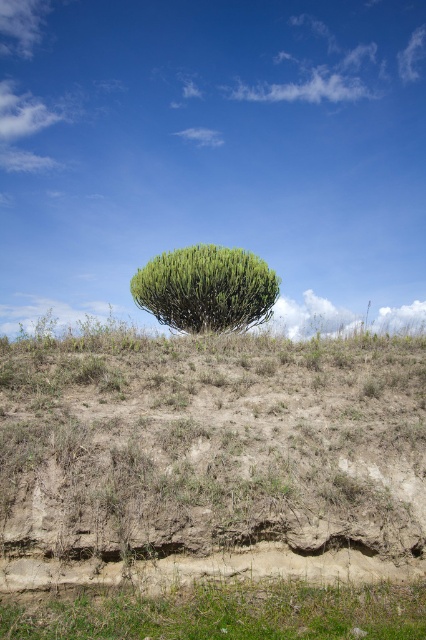
Image resolution: width=426 pixels, height=640 pixels. Describe the element at coordinates (210, 460) in the screenshot. I see `green grassy hillside at center` at that location.

Which is more to the left, green grassy hillside at center or green grassy at lower center?

Positioned to the left is green grassy hillside at center.

Which is behind, point (143, 353) or point (124, 589)?

Point (143, 353)

This screenshot has width=426, height=640. I want to click on green grassy hillside at center, so pos(210,460).

Does green grassy hillside at center have a greater height compared to green leafy tree at center?

No, green grassy hillside at center is not taller than green leafy tree at center.

Looking at this image, which is above, green grassy hillside at center or green leafy tree at center?

green leafy tree at center

Measure the distance between point (37, 449) and camera.

Point (37, 449) and camera are 16.03 feet apart.

Identify the location of green grassy hillside at center. This screenshot has height=640, width=426. (210, 460).

Measure the distance between green grassy at lower center and camera.

They are 11.82 feet apart.

Is green grassy at lower center below green leafy tree at center?

Indeed, green grassy at lower center is positioned under green leafy tree at center.

Measure the distance between point (261, 620) and camera.

The distance of point (261, 620) from camera is 3.85 meters.

At what (x,y) coordinates should I click in order to perform the action: click on green grassy at lower center. Please return your answer as a coordinate pair (x, y). Looking at the image, I should click on (218, 612).